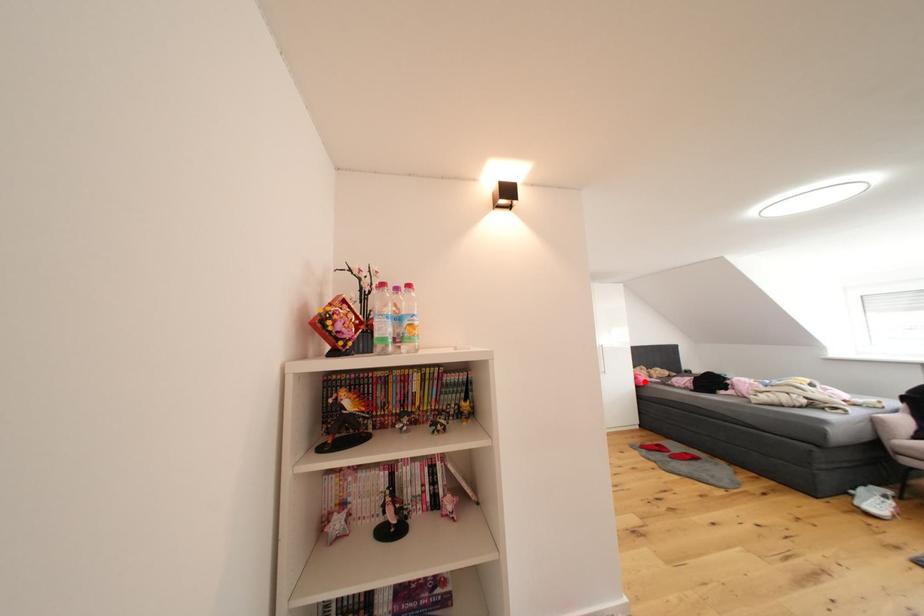
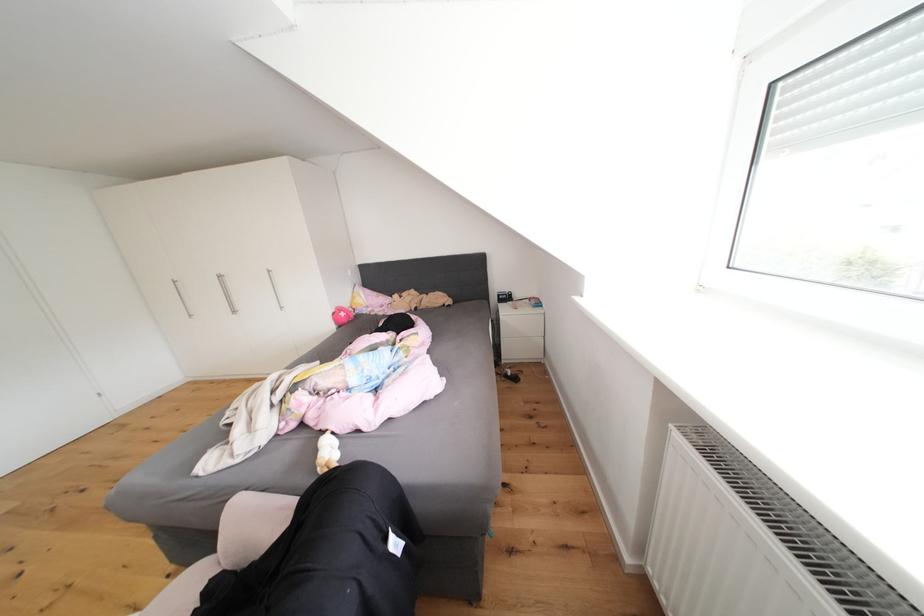
The point at the highlighted location is marked in the first image. Where is the corresponding point in the second image?

(343, 318)